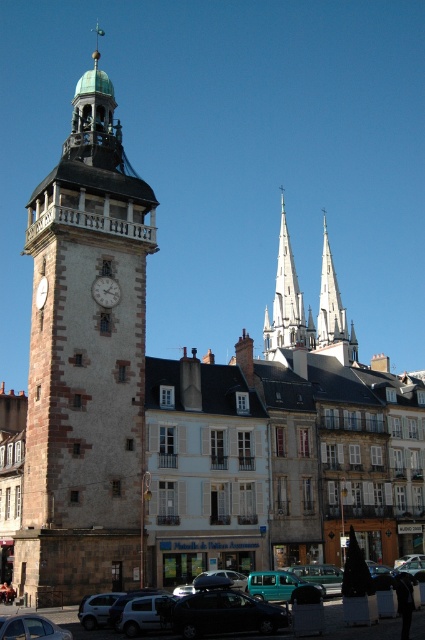
You are an architect analyzing the layout of this urban scene. The brown stone clock tower at left is part of your design. What are the coordinates of its position in the 2D plane?

The coordinates of the brown stone clock tower at left are at point (85, 364).

You are driving a teal matte van at center and want to park it so that it faces away from the white stone spires at center. Which direction should you turn the van?

The white stone spires at center are to the right of the teal matte van at center. To face away from them, you should turn the van to the left so that it faces the opposite direction of the spires.

You are a delivery driver who needs to park your teal matte van at center as close as possible to the brown stone clock tower at left without blocking the entrance. The parking space allows you to park up to 40 meters away from the destination. Can you park your van in this location?

The distance between the brown stone clock tower at left and the teal matte van at center is 39.95 meters, which is within the 40 meters limit. Therefore, you can park the teal matte van at center near the brown stone clock tower at left without blocking the entrance.